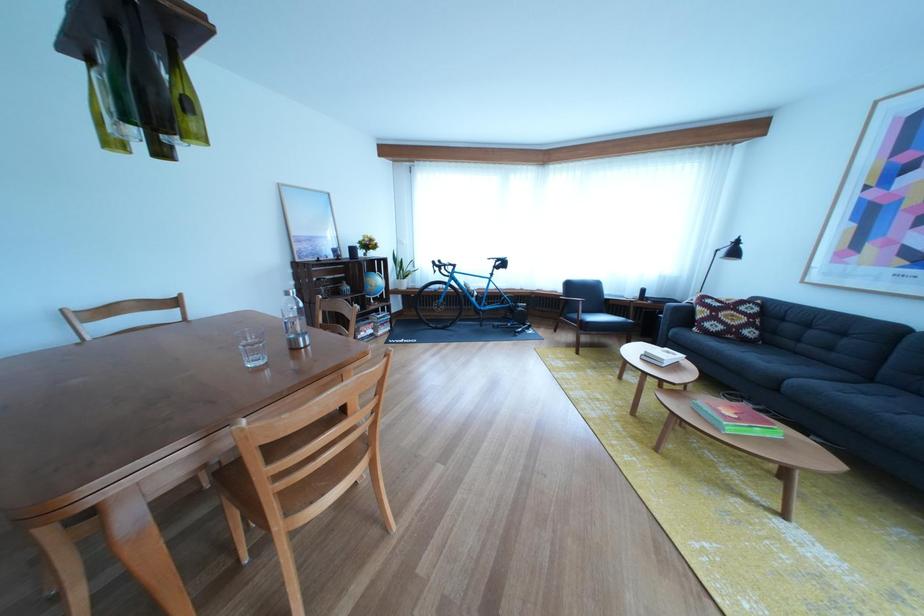
This screenshot has height=616, width=924. Find the location of `colorful book`. colorful book is located at coordinates (735, 418).